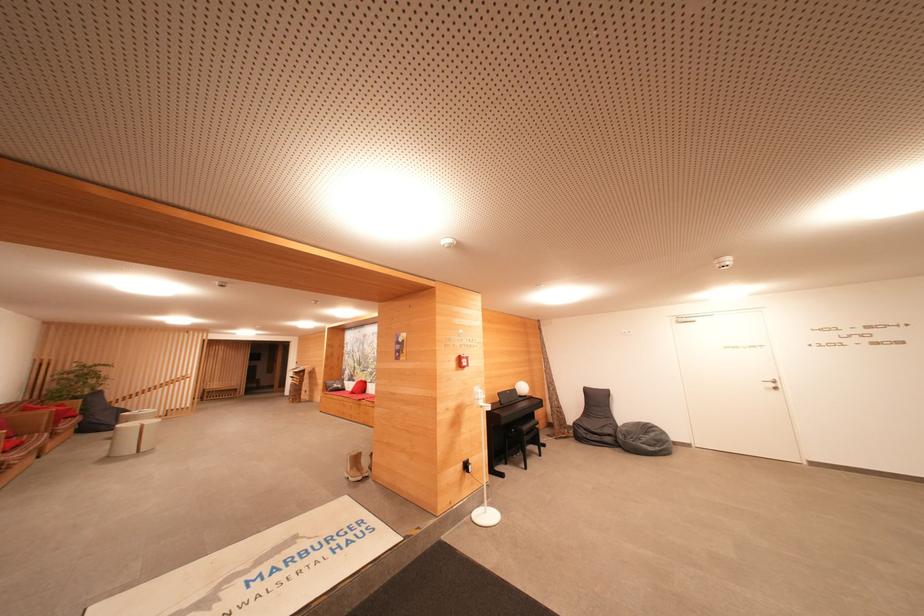
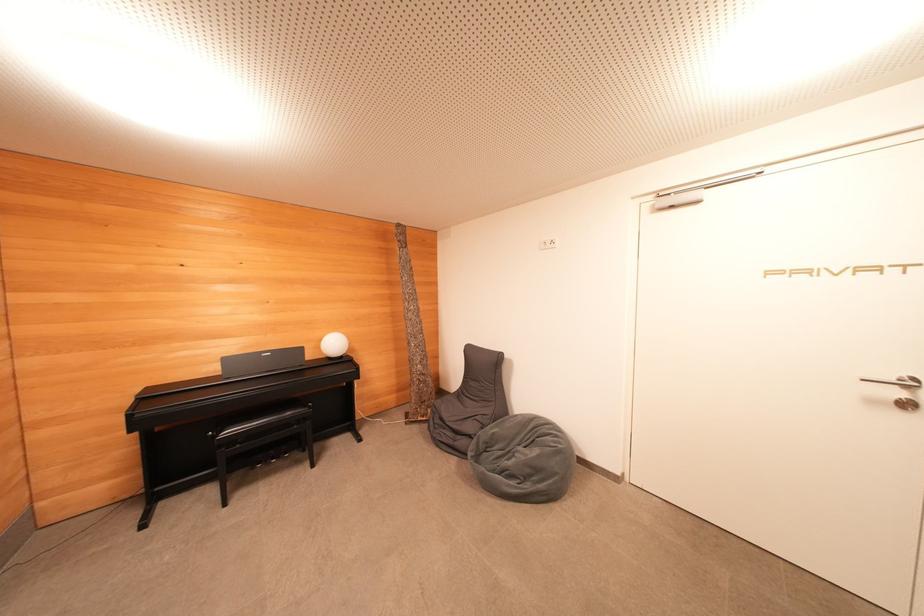
In the second image, find the point that corresponds to [655,438] in the first image.

(540, 455)